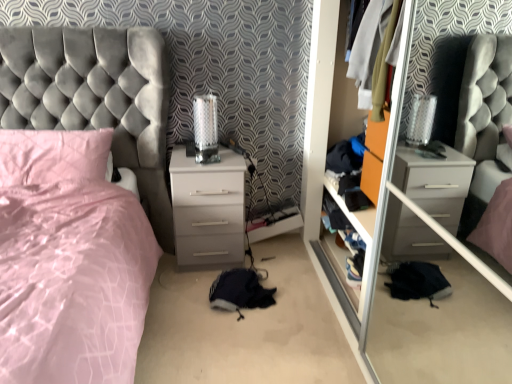
Find the location of a particular element. This screenshot has height=384, width=512. free space on the front side of white glossy chest of drawers at center is located at coordinates (180, 297).